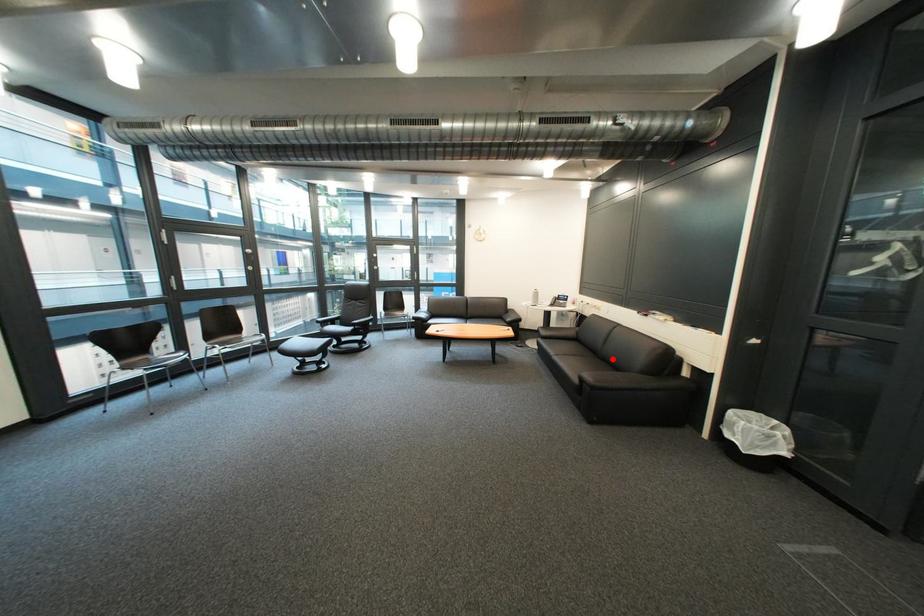
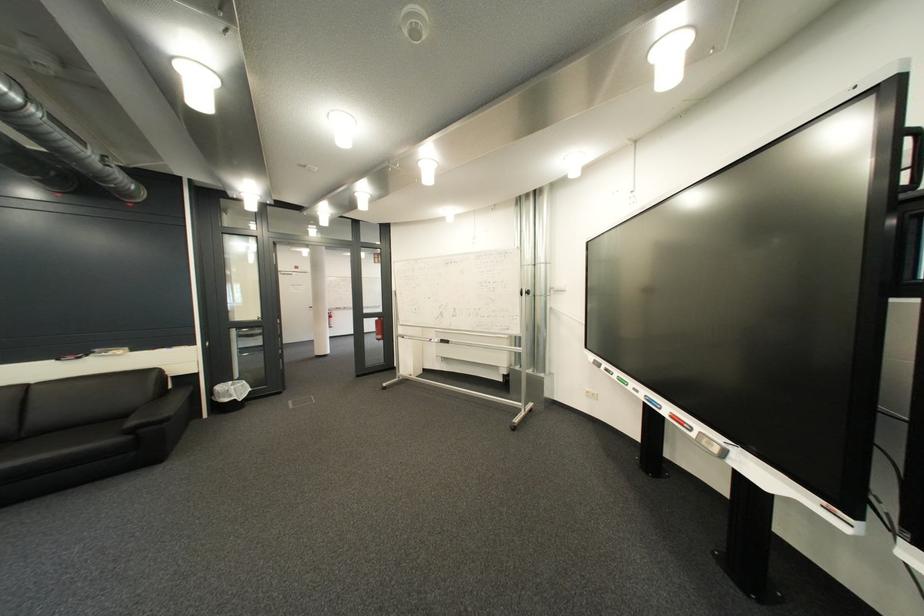
Question: I am providing you with two images of the same scene from different viewpoints. Given a red point in image1, look at the same physical point in image2. Is it:

Choices:
 (A) Closer to the viewpoint
 (B) Farther from the viewpoint

Answer: (A)